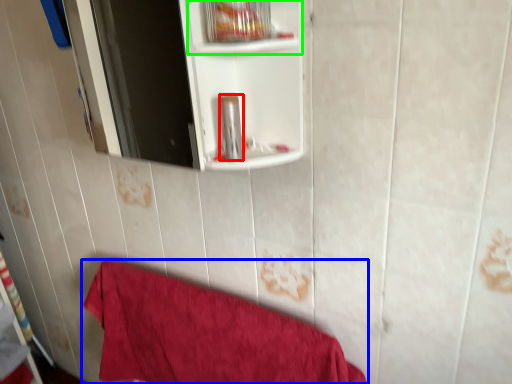
Question: Estimate the real-world distances between objects in this image. Which object is closer to toiletry (highlighted by a red box), towel (highlighted by a blue box) or cabinet (highlighted by a green box)?

Choices:
 (A) towel
 (B) cabinet

Answer: (B)